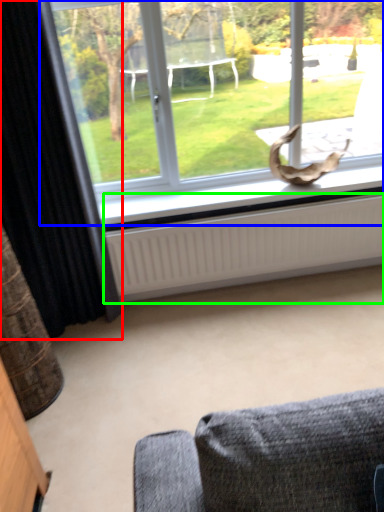
Question: Estimate the real-world distances between objects in this image. Which object is farther from curtain (highlighted by a red box), window (highlighted by a blue box) or radiator (highlighted by a green box)?

Choices:
 (A) window
 (B) radiator

Answer: (A)